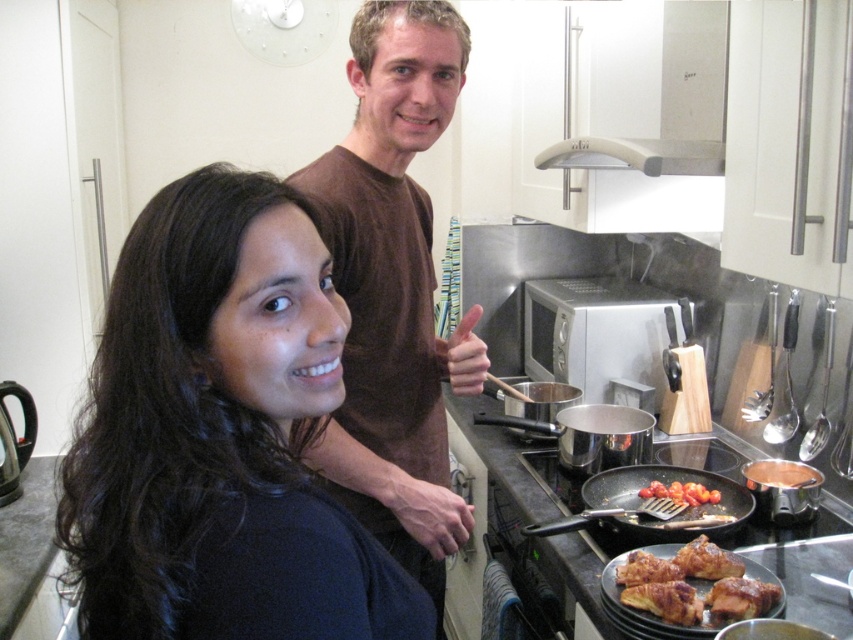
Does black matte hair at upper left appear on the right side of shiny red tomatoes at center?

In fact, black matte hair at upper left is to the left of shiny red tomatoes at center.

Between black matte hair at upper left and shiny red tomatoes at center, which one has less height?

shiny red tomatoes at center is shorter.

Is point (136, 385) farther from viewer compared to point (697, 486)?

No.

The height and width of the screenshot is (640, 853). I want to click on black matte hair at upper left, so click(x=216, y=442).

Does golden brown crispy croissant at lower right have a greater width compared to black non-stick frying pan at lower right?

Incorrect, golden brown crispy croissant at lower right's width does not surpass black non-stick frying pan at lower right's.

At what (x,y) coordinates should I click in order to perform the action: click on golden brown crispy croissant at lower right. Please return your answer as a coordinate pair (x, y). The width and height of the screenshot is (853, 640). Looking at the image, I should click on (695, 586).

Who is positioned more to the left, golden crispy croissant at lower right or shiny red tomatoes at center?

golden crispy croissant at lower right

Can you confirm if golden crispy croissant at lower right is positioned to the left of shiny red tomatoes at center?

Correct, you'll find golden crispy croissant at lower right to the left of shiny red tomatoes at center.

Is point (636, 586) more distant than point (651, 490)?

No, (636, 586) is in front of (651, 490).

Identify the location of golden crispy croissant at lower right. This screenshot has width=853, height=640. (665, 600).